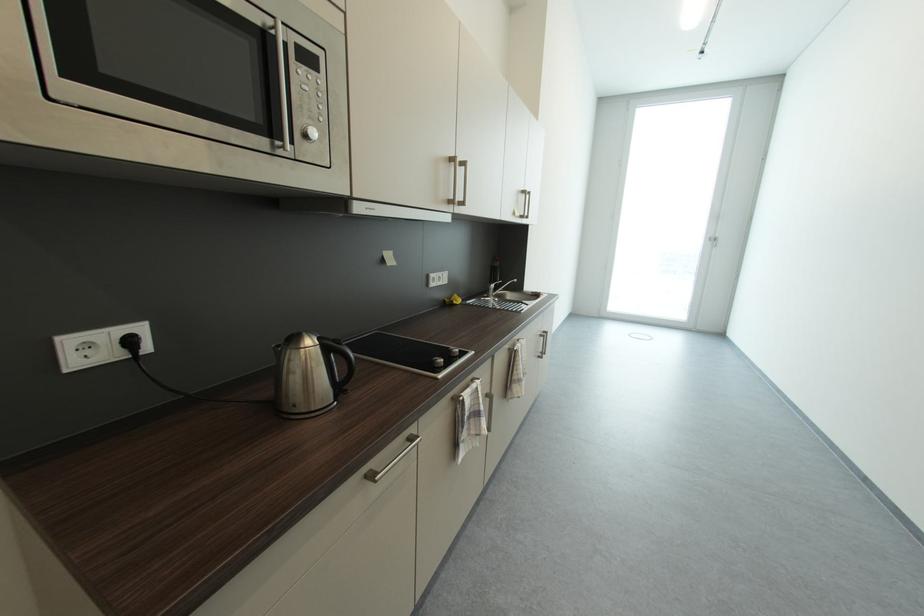
In order to click on microwave control knob in this screenshot , I will do `click(310, 89)`.